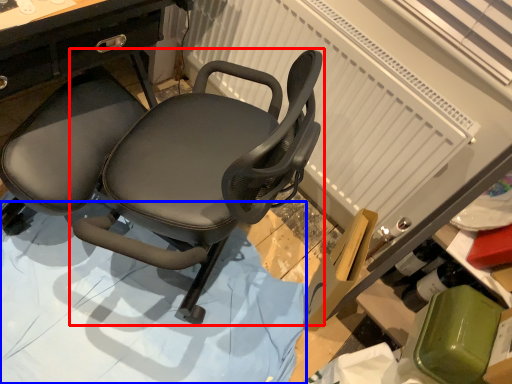
Question: Which object is closer to the camera taking this photo, chair (highlighted by a red box) or surface (highlighted by a blue box)?

Choices:
 (A) chair
 (B) surface

Answer: (A)